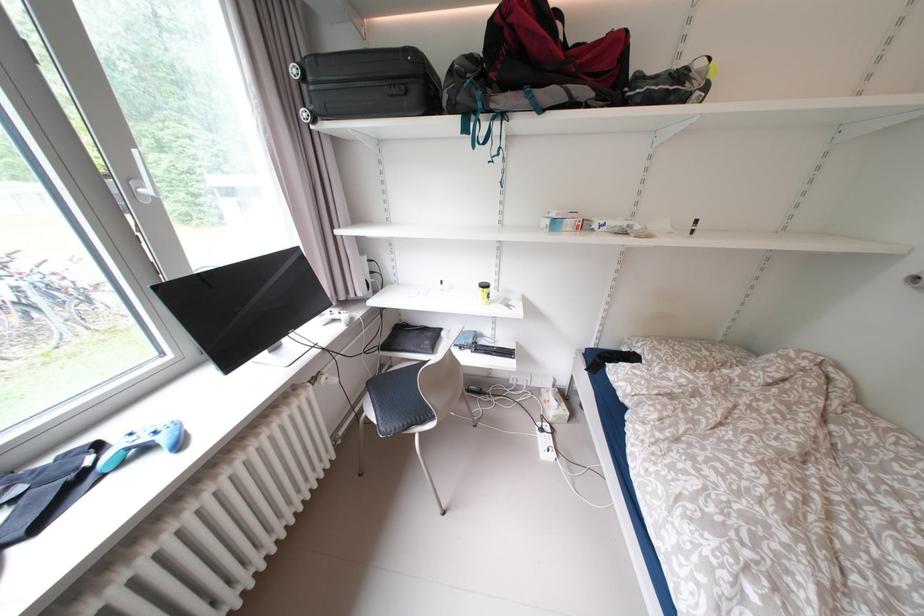
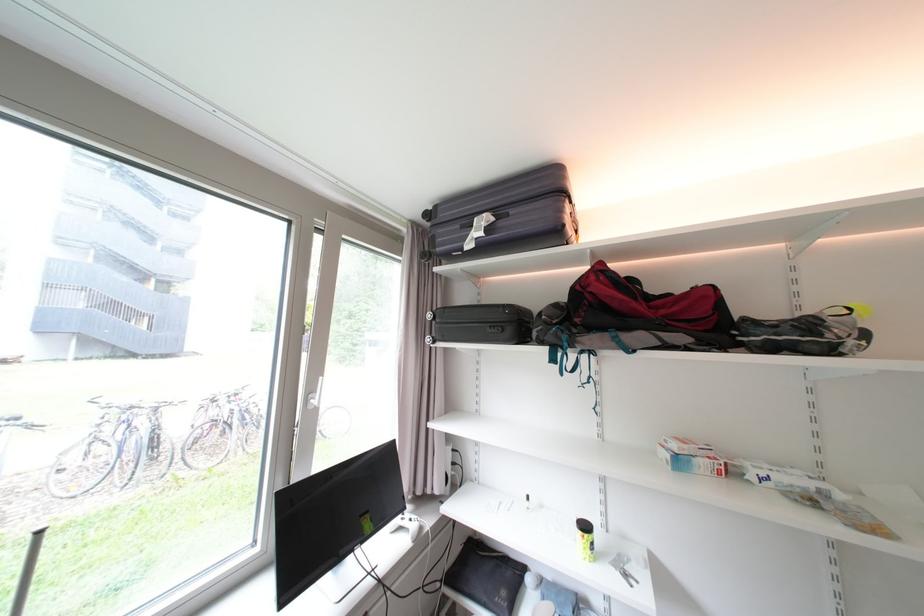
Find the pixel in the second image that matches (x=347, y=321) in the first image.

(417, 530)